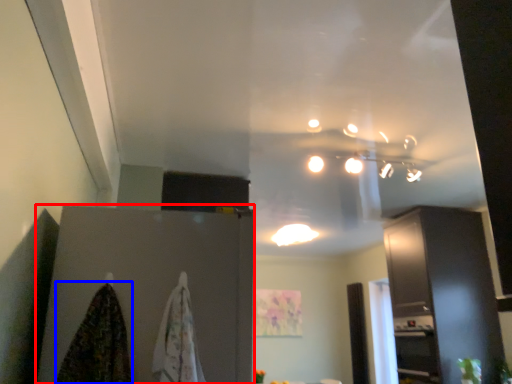
Question: Which object appears farthest to the camera in this image, cabinetry (highlighted by a red box) or blanket (highlighted by a blue box)?

Choices:
 (A) cabinetry
 (B) blanket

Answer: (A)